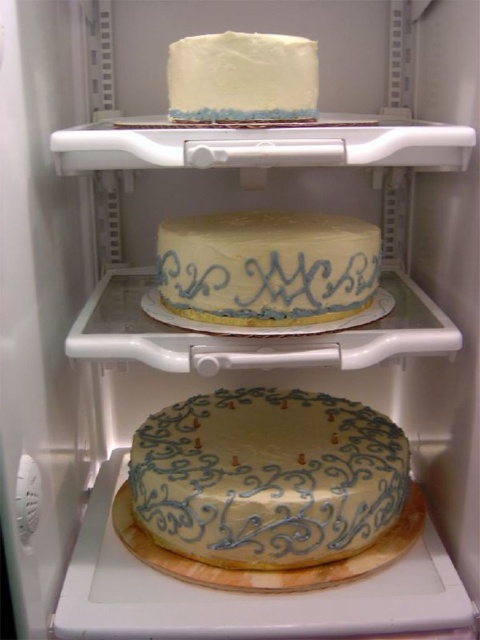
Identify the location of yellow matte cake at lower center. The height and width of the screenshot is (640, 480). (267, 477).

Which is in front, point (173, 481) or point (204, 316)?

Positioned in front is point (204, 316).

Who is more distant from viewer, (371, 456) or (167, 225)?

The point (371, 456) is behind.

Where is `yellow matte cake at lower center`? yellow matte cake at lower center is located at coordinates (267, 477).

Is white buttercream cake at center wider than white matte cake at upper center?

Correct, the width of white buttercream cake at center exceeds that of white matte cake at upper center.

Consider the image. Who is more forward, (x=300, y=301) or (x=194, y=92)?

Point (x=194, y=92) is more forward.

At what (x,y) coordinates should I click in order to perform the action: click on white buttercream cake at center. Please return your answer as a coordinate pair (x, y). The image size is (480, 640). Looking at the image, I should click on point(266,268).

In the scene shown: Which is more to the right, yellow matte cake at lower center or white matte cake at upper center?

From the viewer's perspective, yellow matte cake at lower center appears more on the right side.

Between point (348, 496) and point (254, 83), which one is positioned in front?

Point (254, 83) is in front.

Locate an element on the screen. yellow matte cake at lower center is located at coordinates (267, 477).